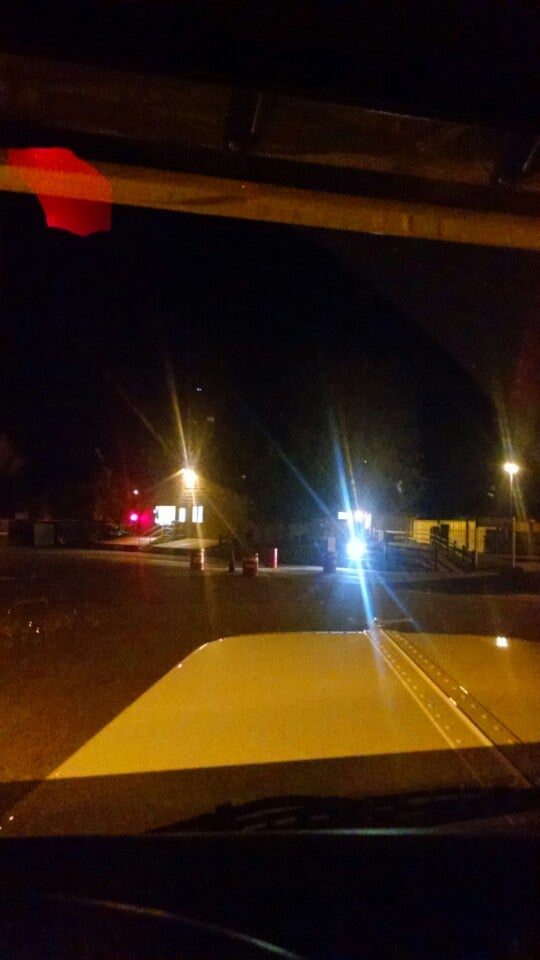
Identify the location of window. (172, 511), (180, 513), (195, 513).